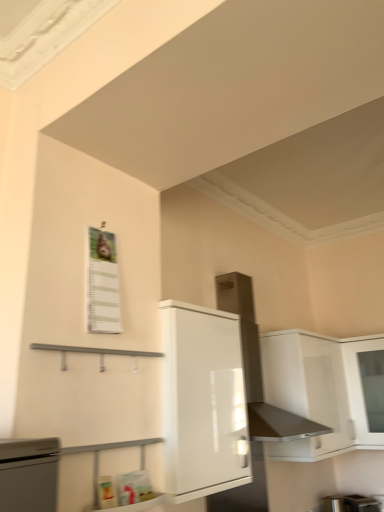
Question: Considering the relative sizes of white glossy cabinet at center, which is counted as the second cabinetry, starting from the back, and satin silver exhaust hood at upper center in the image provided, is white glossy cabinet at center, which is counted as the second cabinetry, starting from the back, bigger than satin silver exhaust hood at upper center?

Choices:
 (A) yes
 (B) no

Answer: (B)

Question: From the image's perspective, would you say white glossy cabinet at center, which is counted as the second cabinetry, starting from the back, is positioned over satin silver exhaust hood at upper center?

Choices:
 (A) no
 (B) yes

Answer: (A)

Question: Can you confirm if white glossy cabinet at center, the 2th cabinetry when ordered from right to left, is taller than satin silver exhaust hood at upper center?

Choices:
 (A) yes
 (B) no

Answer: (B)

Question: Considering the relative sizes of white glossy cabinet at center, which is the 1th cabinetry in left-to-right order, and satin silver exhaust hood at upper center in the image provided, is white glossy cabinet at center, which is the 1th cabinetry in left-to-right order, thinner than satin silver exhaust hood at upper center?

Choices:
 (A) yes
 (B) no

Answer: (A)

Question: Are white glossy cabinet at center, which is counted as the first cabinetry, starting from the front, and satin silver exhaust hood at upper center making contact?

Choices:
 (A) yes
 (B) no

Answer: (B)

Question: Considering the positions of metallic silver toaster at lower right and white glossy cabinet at center, which is counted as the first cabinetry, starting from the front, in the image, is metallic silver toaster at lower right wider or thinner than white glossy cabinet at center, which is counted as the first cabinetry, starting from the front,?

Choices:
 (A) thin
 (B) wide

Answer: (A)

Question: In terms of height, does metallic silver toaster at lower right look taller or shorter compared to white glossy cabinet at center, which is the 1th cabinetry in left-to-right order?

Choices:
 (A) short
 (B) tall

Answer: (A)

Question: Is metallic silver toaster at lower right inside the boundaries of white glossy cabinet at center, which is the 1th cabinetry in left-to-right order, or outside?

Choices:
 (A) inside
 (B) outside

Answer: (B)

Question: In the image, is metallic silver toaster at lower right on the left side or the right side of white glossy cabinet at center, which is counted as the second cabinetry, starting from the back?

Choices:
 (A) right
 (B) left

Answer: (A)

Question: From the image's perspective, is white glossy cabinet at upper right, the 2th cabinetry in the left-to-right sequence, above or below white glossy cabinet at center, which is counted as the second cabinetry, starting from the back?

Choices:
 (A) above
 (B) below

Answer: (B)

Question: In terms of size, does white glossy cabinet at upper right, which is counted as the first cabinetry, starting from the back, appear bigger or smaller than white glossy cabinet at center, which is counted as the second cabinetry, starting from the back?

Choices:
 (A) big
 (B) small

Answer: (A)

Question: Relative to white glossy cabinet at center, the 2th cabinetry when ordered from right to left, is white glossy cabinet at upper right, which is the first cabinetry in right-to-left order, in front or behind?

Choices:
 (A) behind
 (B) front

Answer: (A)

Question: Is point (336, 377) closer or farther from the camera than point (226, 422)?

Choices:
 (A) closer
 (B) farther

Answer: (B)

Question: Considering the positions of point (165, 312) and point (294, 416), is point (165, 312) closer or farther from the camera than point (294, 416)?

Choices:
 (A) farther
 (B) closer

Answer: (B)

Question: From a real-world perspective, relative to satin silver exhaust hood at upper center, is white glossy cabinet at center, the 2th cabinetry when ordered from right to left, vertically above or below?

Choices:
 (A) below
 (B) above

Answer: (A)